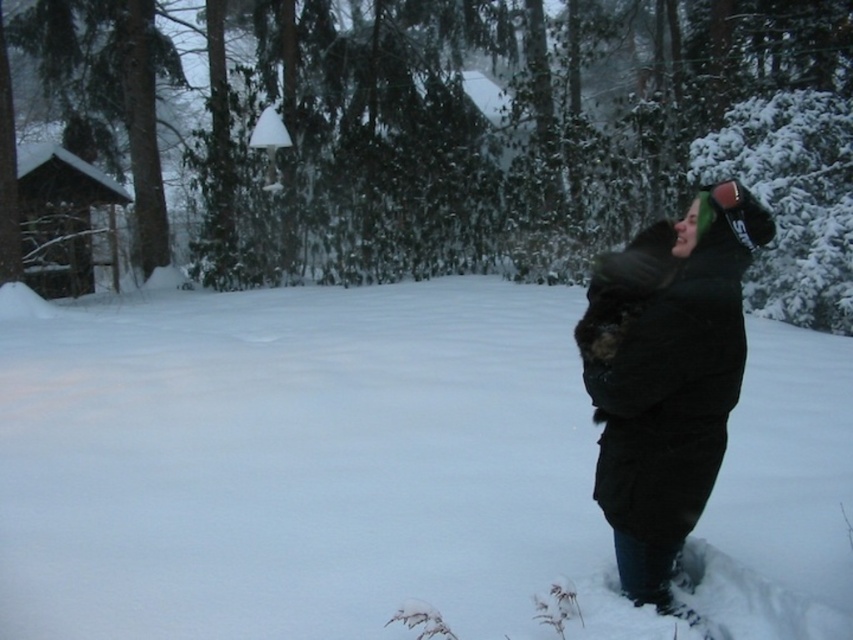
Does white fluffy snow at center lie behind black fuzzy coat at right?

Yes, it is.

Can you confirm if white fluffy snow at center is positioned below black fuzzy coat at right?

Incorrect, white fluffy snow at center is not positioned below black fuzzy coat at right.

Where is `white fluffy snow at center`? This screenshot has width=853, height=640. white fluffy snow at center is located at coordinates (299, 465).